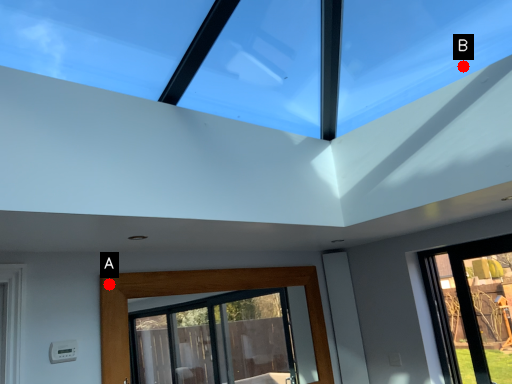
Question: Two points are circled on the image, labeled by A and B beside each circle. Which point is closer to the camera?

Choices:
 (A) A is closer
 (B) B is closer

Answer: (B)